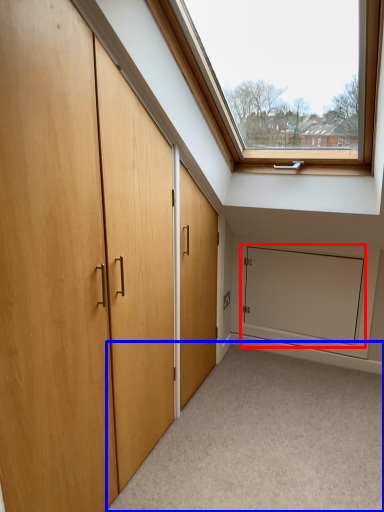
Question: Which object appears farthest to the camera in this image, screen door (highlighted by a red box) or corridor (highlighted by a blue box)?

Choices:
 (A) screen door
 (B) corridor

Answer: (A)